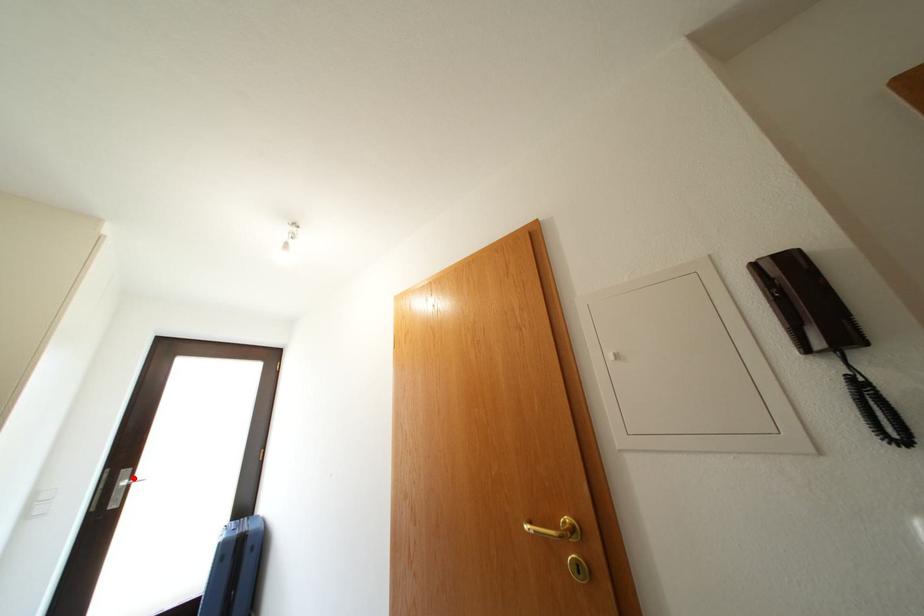
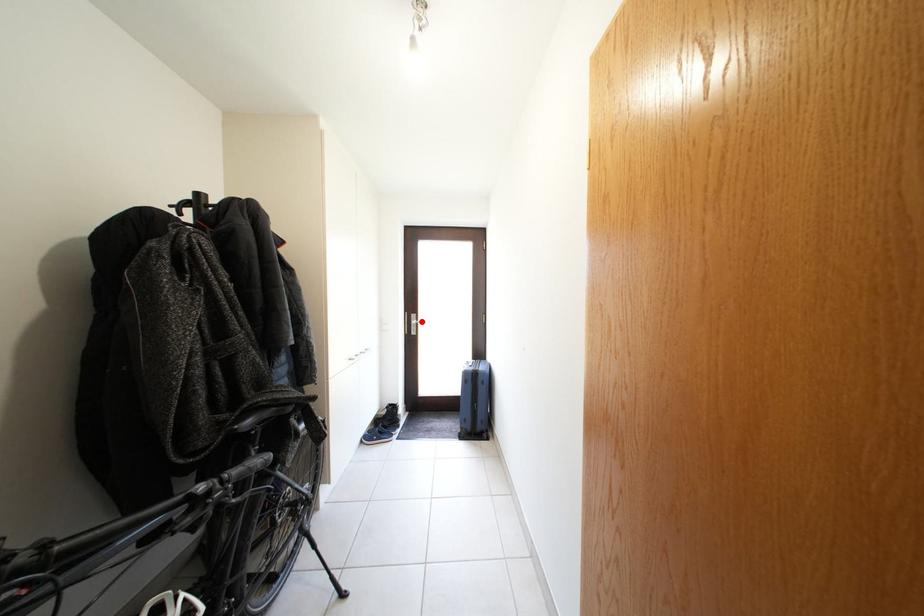
I am providing you with two images of the same scene from different viewpoints. A red point is marked on the first image and another point is marked on the second image. Does the point marked in image1 correspond to the same location as the one in image2?

Yes